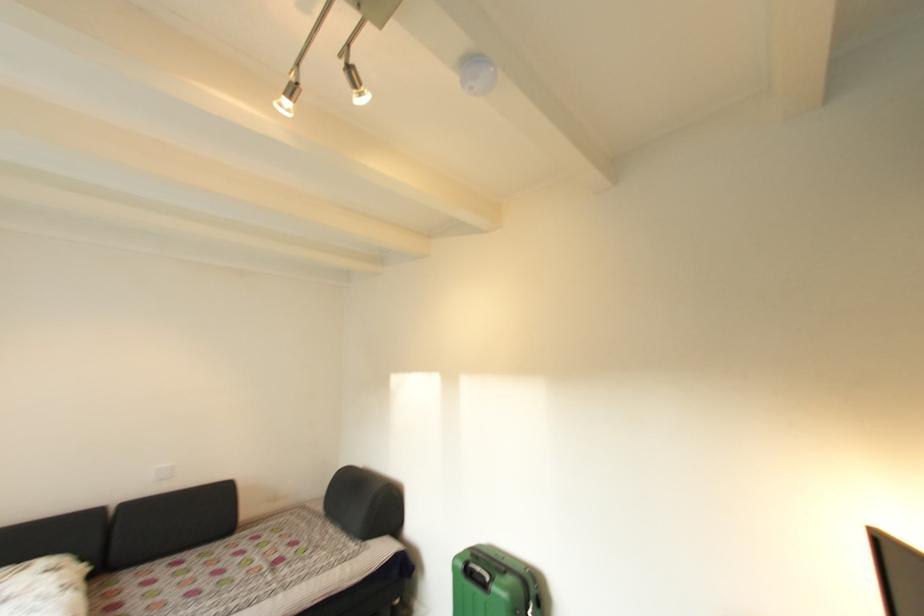
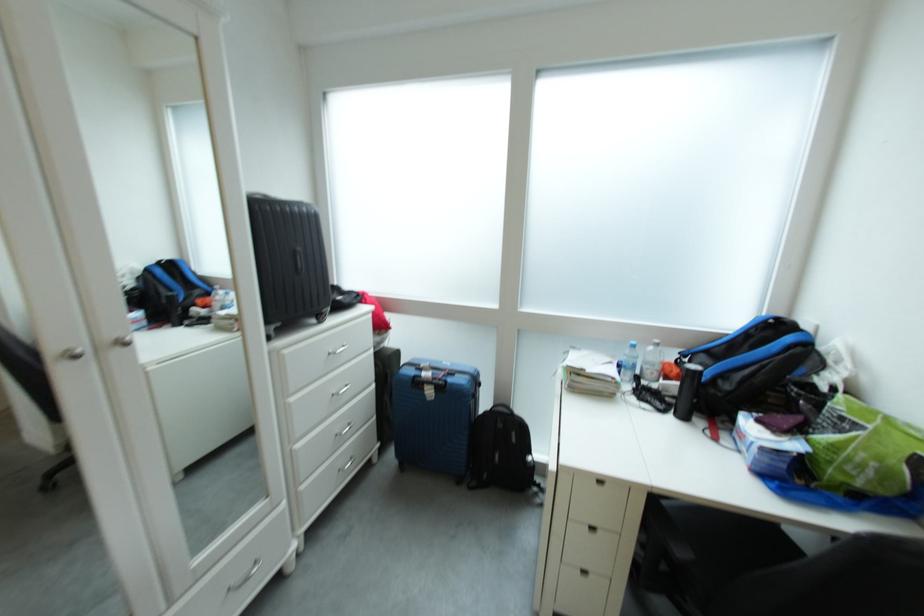
Question: The camera is either moving clockwise (left) or counter-clockwise (right) around the object. The first image is from the beginning of the video and the second image is from the end. Is the camera moving left or right when shooting the video?

Choices:
 (A) Left
 (B) Right

Answer: (A)